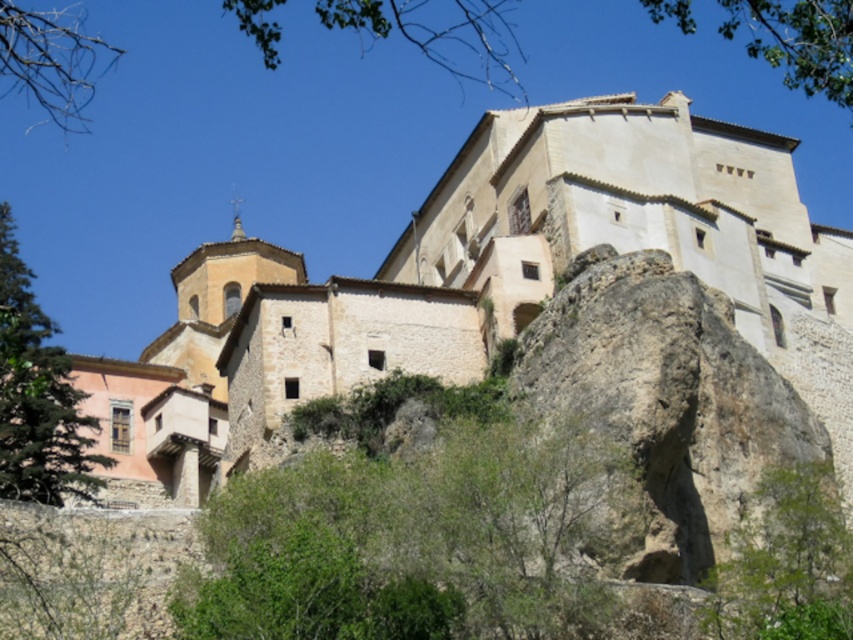
Looking at this image, you are a photographer standing at the base of the hill where the historic stone building is located. You want to capture a photo of the green leafy tree at center in the foreground while including the building in the background. Given your current position, will the tree block the view of the building?

The green leafy tree at center is 160.33 feet from camera, so it will not block the view of the building since it is positioned far enough away to allow both the tree and the building to be visible in the same frame.

You are standing in front of the historic stone building and want to take a photo that includes both the green leafy tree at center and the green leafy tree at lower right. Which tree should you move towards to ensure both are in the frame?

To include both the green leafy tree at center and the green leafy tree at lower right in the frame, you should move towards the green leafy tree at lower right because the green leafy tree at center is closer to the viewer and the green leafy tree at lower right is farther away. By moving towards the farther tree, you can better balance their positions within the camera frame.